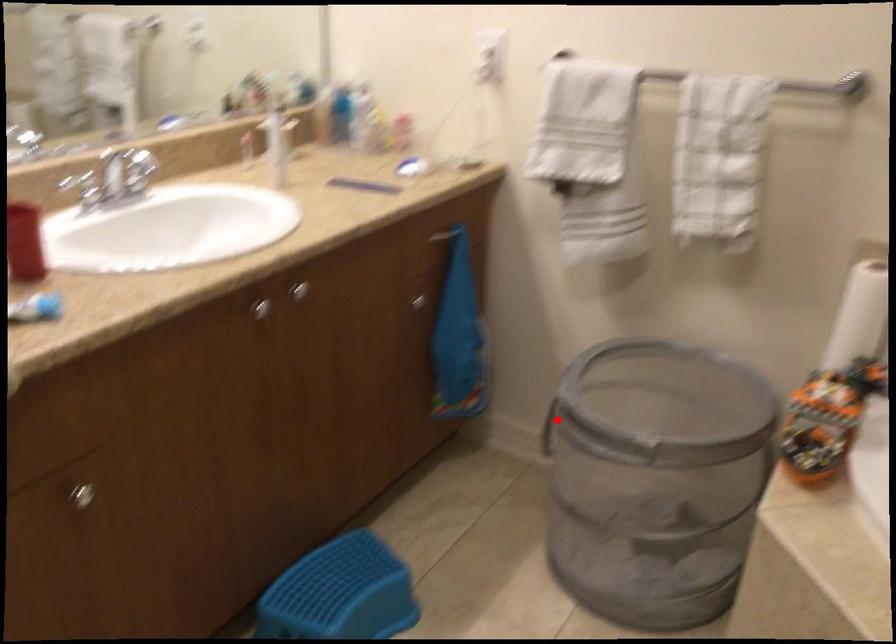
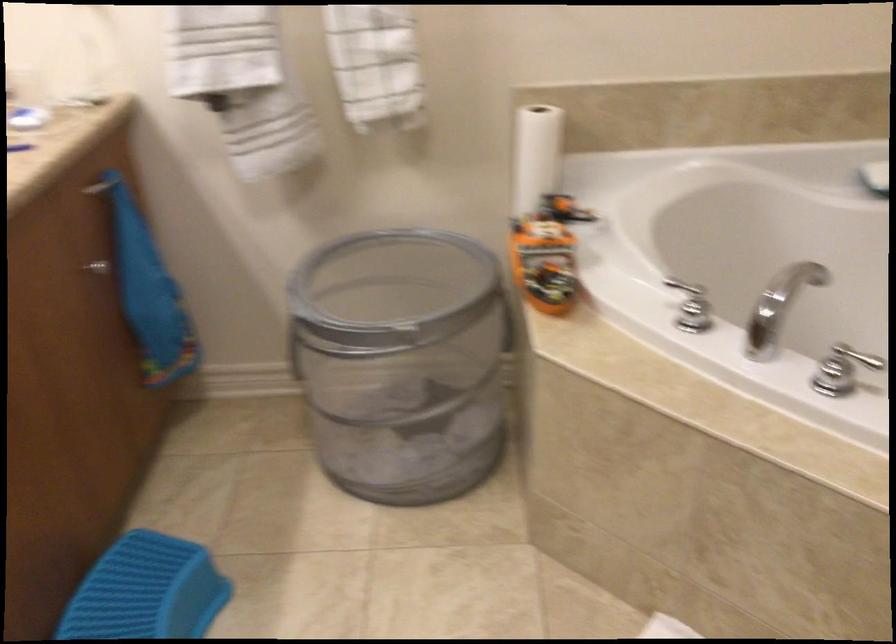
Question: I am providing you with two images of the same scene from different viewpoints. A red point is marked on the first image. Is the red point's position out of view in image 2?

Choices:
 (A) Yes
 (B) No

Answer: (B)